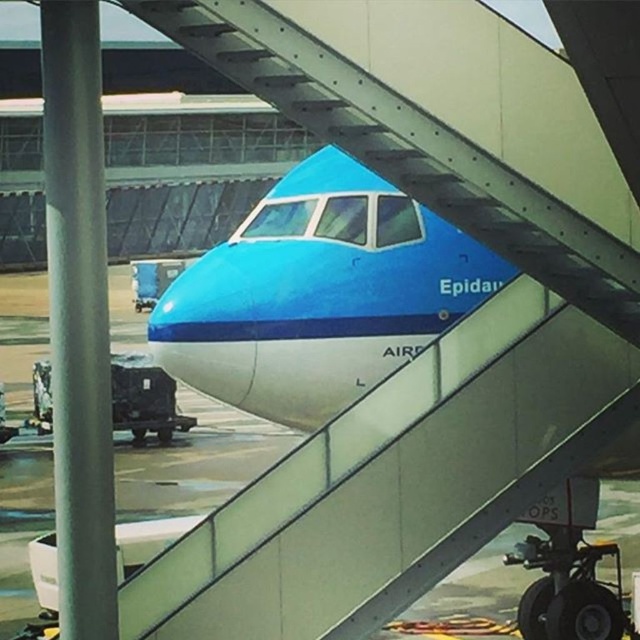
Question: Can you confirm if blue glossy airplane at center is wider than metallic gray staircase at center?

Choices:
 (A) no
 (B) yes

Answer: (A)

Question: Does blue glossy airplane at center have a larger size compared to metallic gray staircase at center?

Choices:
 (A) yes
 (B) no

Answer: (B)

Question: Is blue glossy airplane at center wider than metallic gray staircase at center?

Choices:
 (A) yes
 (B) no

Answer: (B)

Question: Among these objects, which one is farthest from the camera?

Choices:
 (A) blue glossy airplane at center
 (B) metallic gray staircase at center

Answer: (A)